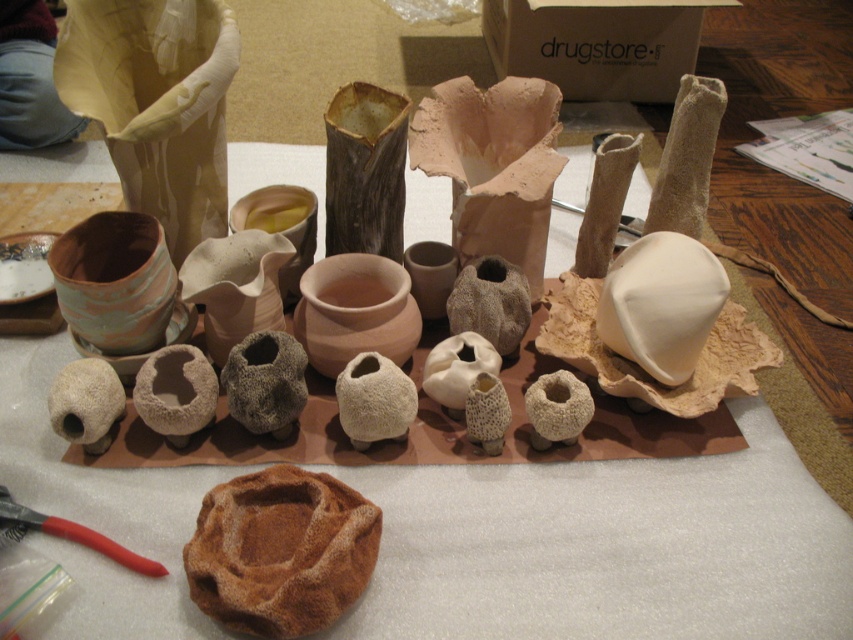
Is matte clay vase at center further to the viewer compared to matte clay pot at center?

That is True.

Does matte clay vase at center come in front of matte clay pot at center?

No, it is not.

Describe the element at coordinates (492, 164) in the screenshot. This screenshot has width=853, height=640. I see `matte clay vase at center` at that location.

Where is `matte clay vase at center`? matte clay vase at center is located at coordinates (492, 164).

Measure the distance between terracotta clay pot at center-left and matte clay pot at center.

They are 13.01 inches apart.

Is point (115, 236) more distant than point (364, 307)?

No, it is not.

Which is behind, point (142, 273) or point (366, 310)?

The point (366, 310) is more distant.

Locate an element on the screen. This screenshot has width=853, height=640. terracotta clay pot at center-left is located at coordinates (115, 282).

Is matte clay vase at center to the right of terracotta clay pot at center-left from the viewer's perspective?

Yes, matte clay vase at center is to the right of terracotta clay pot at center-left.

Who is positioned more to the left, matte clay vase at center or terracotta clay pot at center-left?

Positioned to the left is terracotta clay pot at center-left.

Is point (469, 179) in front of point (125, 296)?

No, (469, 179) is behind (125, 296).

This screenshot has height=640, width=853. In order to click on matte clay vase at center in this screenshot , I will do `click(492, 164)`.